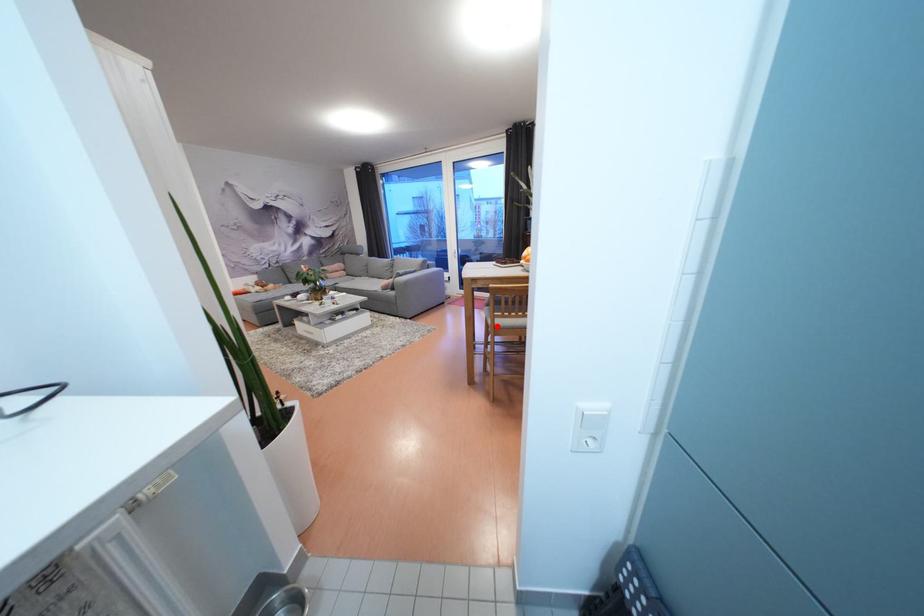
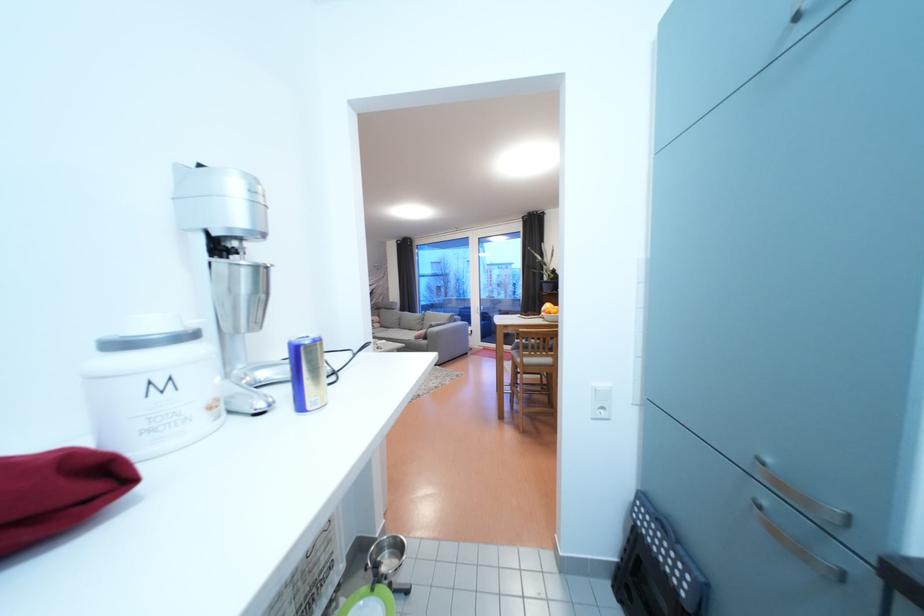
In the second image, find the point that corresponds to the highlighted location in the first image.

(526, 365)